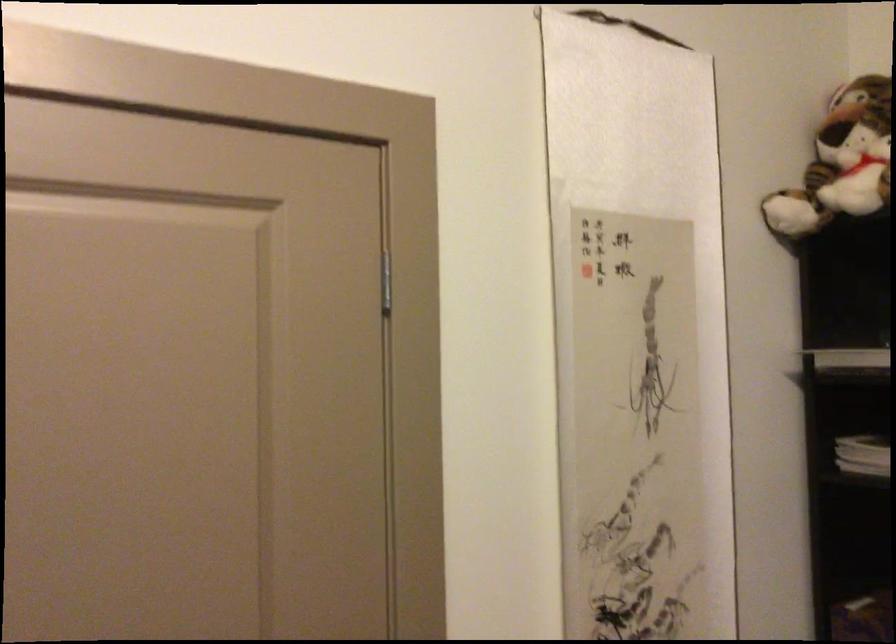
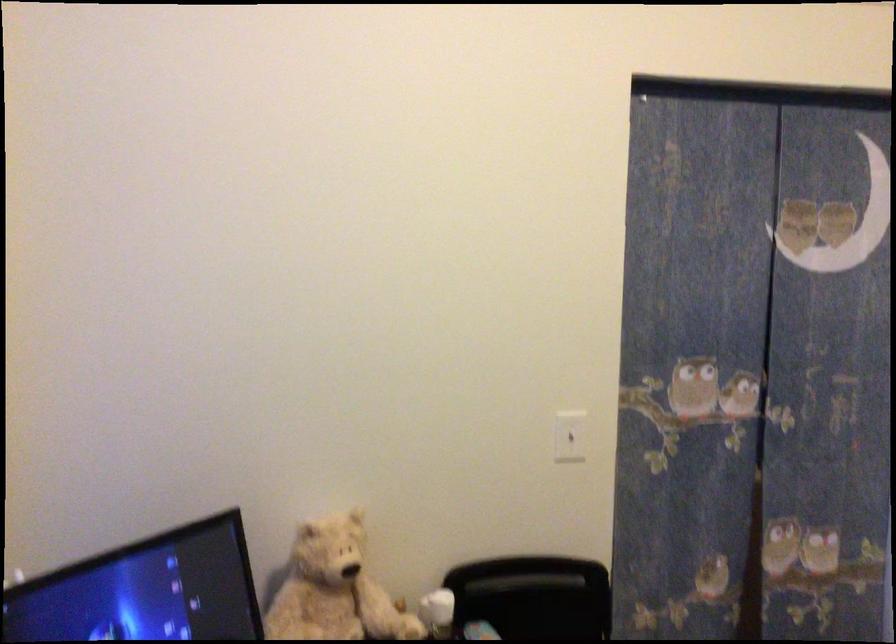
Question: The images are taken continuously from a first-person perspective. In which direction is your viewpoint rotating?

Choices:
 (A) Left
 (B) Right
 (C) Up
 (D) Down

Answer: (A)